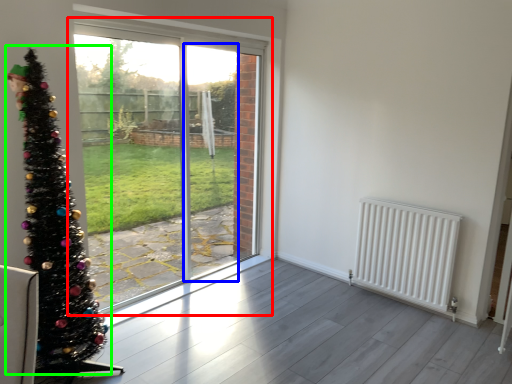
Question: Considering the real-world distances, which object is farthest from window (highlighted by a red box)? screen door (highlighted by a blue box) or christmas tree (highlighted by a green box)?

Choices:
 (A) screen door
 (B) christmas tree

Answer: (B)